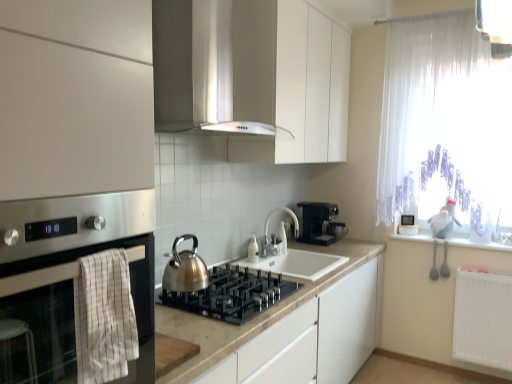
Question: From a real-world perspective, is stainless steel oven at left positioned above or below white glossy faucet at center?

Choices:
 (A) below
 (B) above

Answer: (B)

Question: Looking at the image, does stainless steel oven at left seem bigger or smaller compared to white glossy faucet at center?

Choices:
 (A) small
 (B) big

Answer: (B)

Question: Which is nearer to the black plastic coffee machine at center?

Choices:
 (A) white glossy faucet at center
 (B) stainless steel oven at left
 (C) black glass gas stove at center
 (D) white plastic radiator at lower right
 (E) shiny metallic kettle at center

Answer: (A)

Question: Which of these objects is positioned closest to the white matte cabinet at upper center?

Choices:
 (A) black glass gas stove at center
 (B) black plastic coffee machine at center
 (C) white striped towel at lower left
 (D) shiny metallic kettle at center
 (E) white plastic radiator at lower right

Answer: (A)